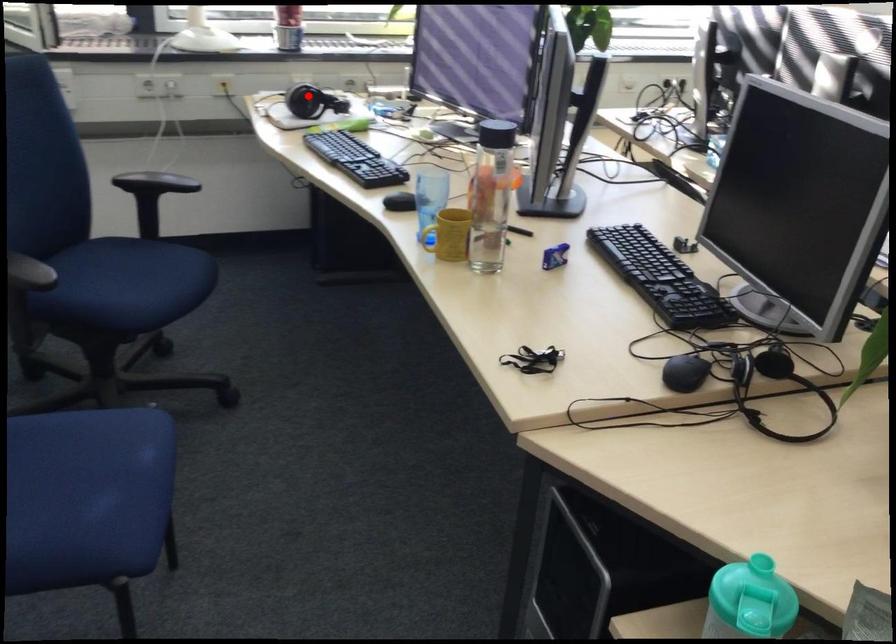
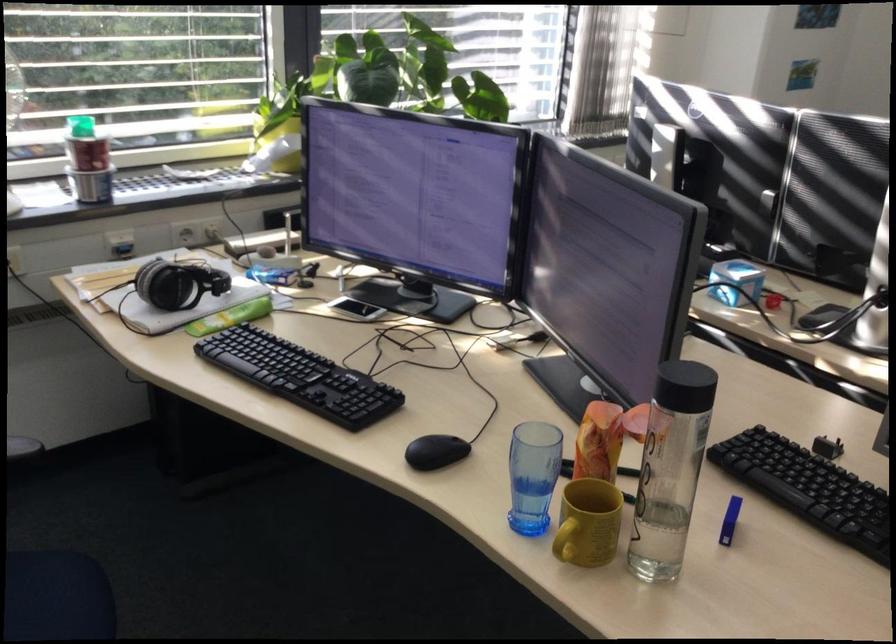
Question: I am providing you with two images of the same scene from different viewpoints. Given a red point in image1, look at the same physical point in image2. Is it:

Choices:
 (A) Closer to the viewpoint
 (B) Farther from the viewpoint

Answer: (A)